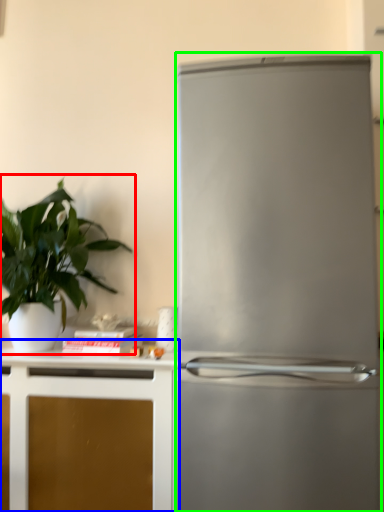
Question: Based on their relative distances, which object is nearer to houseplant (highlighted by a red box)? Choose from cabinetry (highlighted by a blue box) and refrigerator (highlighted by a green box).

Choices:
 (A) cabinetry
 (B) refrigerator

Answer: (A)